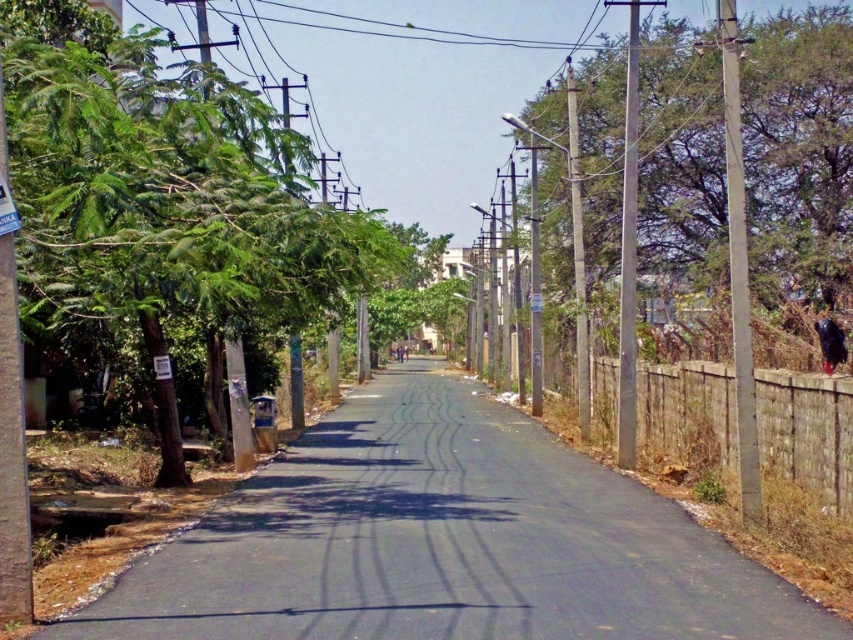
Question: Which object appears closest to the camera in this image?

Choices:
 (A) green leafy tree at left
 (B) black asphalt road at center
 (C) brown wooden fence at right
 (D) green leafy tree at right

Answer: (B)

Question: Estimate the real-world distances between objects in this image. Which object is closer to the green leafy tree at left?

Choices:
 (A) green leafy tree at right
 (B) black asphalt road at center

Answer: (B)

Question: Does green leafy tree at left have a smaller size compared to green leafy tree at right?

Choices:
 (A) no
 (B) yes

Answer: (B)

Question: Does green leafy tree at left appear under green leafy tree at right?

Choices:
 (A) yes
 (B) no

Answer: (A)

Question: Considering the real-world distances, which object is farthest from the green leafy tree at right?

Choices:
 (A) black asphalt road at center
 (B) brown wooden fence at right
 (C) green leafy tree at left

Answer: (C)

Question: Is green leafy tree at right in front of brown wooden fence at right?

Choices:
 (A) no
 (B) yes

Answer: (A)